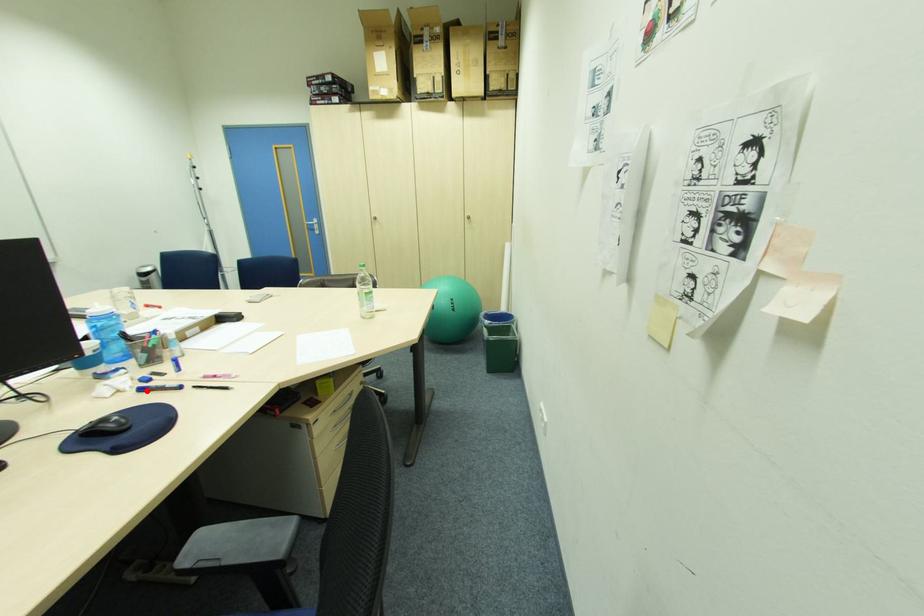
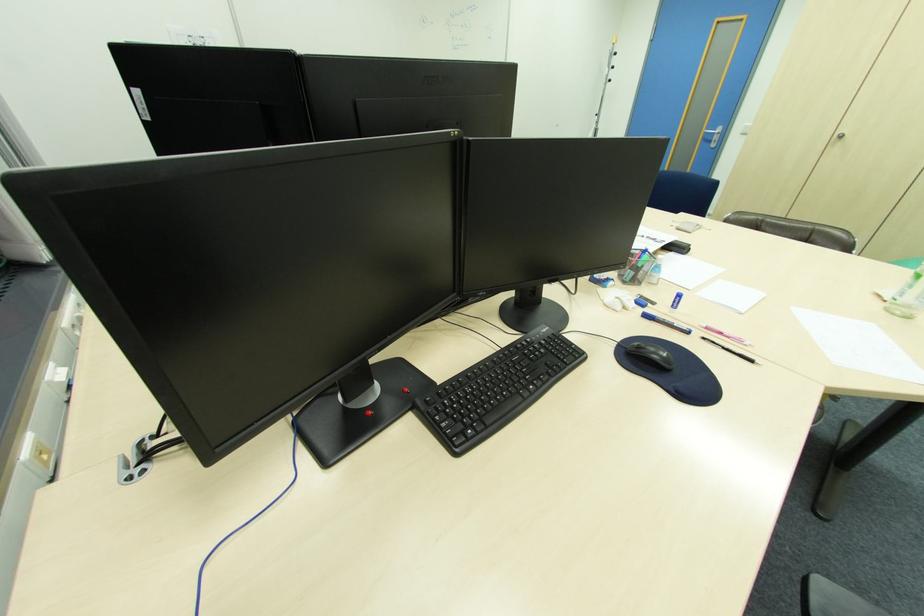
Question: I am providing you with two images of the same scene from different viewpoints. A red point is marked on the first image. Is the red point's position out of view in image 2?

Choices:
 (A) Yes
 (B) No

Answer: (B)